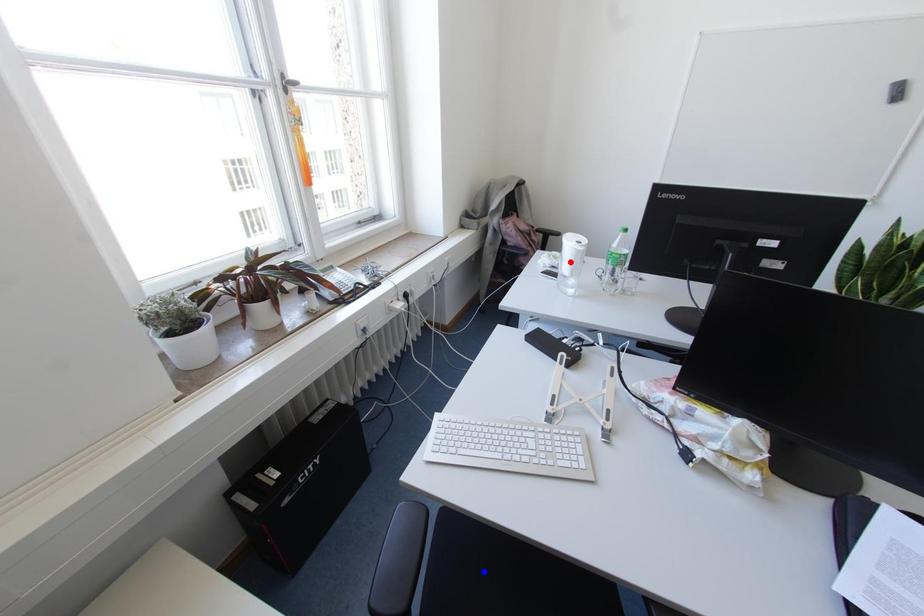
Question: Two points are marked on the image. Which point is closer to the camera?

Choices:
 (A) Blue point is closer.
 (B) Red point is closer.

Answer: (A)